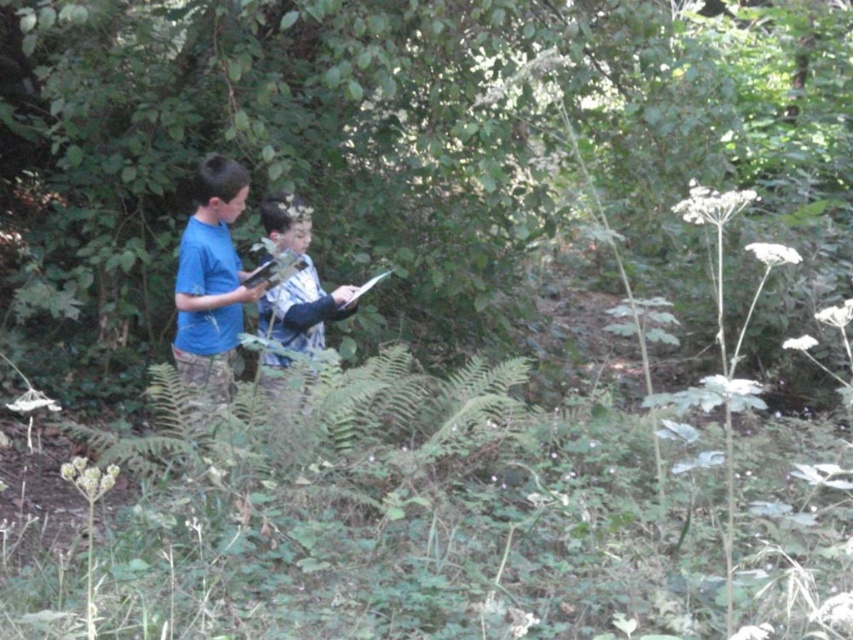
You are a drone operator trying to capture a photo of the two points in the forest scene. The first point is at coordinates point (219, 301) and the second is at point (288, 204). To ensure both are visible in the frame, should you position the camera closer to the first point or the second point?

You should position the camera closer to the second point point (288, 204) because point (219, 301) is in front of point (288, 204). By moving closer to the second point, you can capture both points within the frame without one being obscured.